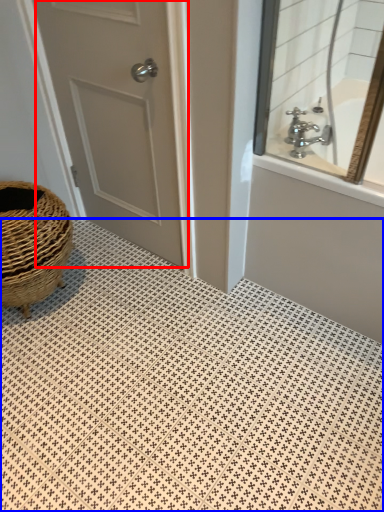
Question: Among these objects, which one is farthest to the camera, door (highlighted by a red box) or pattern (highlighted by a blue box)?

Choices:
 (A) door
 (B) pattern

Answer: (A)